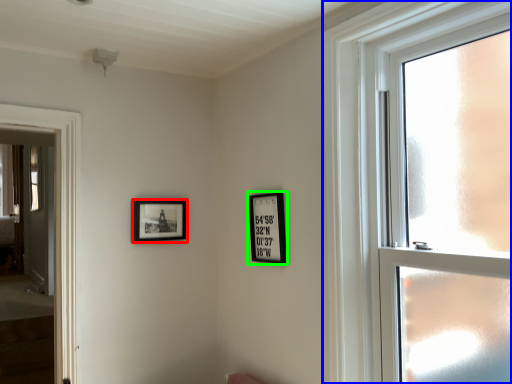
Question: Estimate the real-world distances between objects in this image. Which object is closer to picture frame (highlighted by a red box), window (highlighted by a blue box) or picture frame (highlighted by a green box)?

Choices:
 (A) window
 (B) picture frame

Answer: (B)